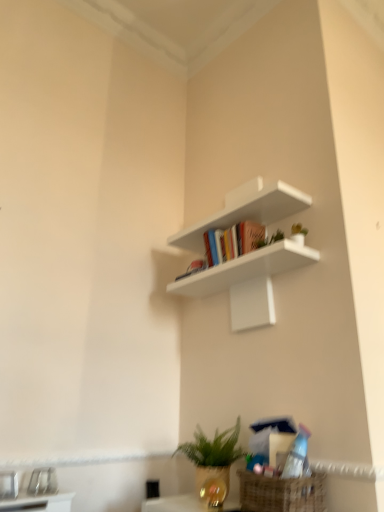
Question: Considering the positions of point (259, 430) and point (213, 280), is point (259, 430) closer or farther from the camera than point (213, 280)?

Choices:
 (A) closer
 (B) farther

Answer: (A)

Question: From a real-world perspective, is matte plastic book at center positioned above or below white matte shelf at upper center?

Choices:
 (A) below
 (B) above

Answer: (A)

Question: Which of these objects is positioned closest to the matte plastic book at center?

Choices:
 (A) white matte shelf at upper center
 (B) green matte plant at lower center

Answer: (B)

Question: Which is farther from the matte plastic book at center?

Choices:
 (A) white matte shelf at upper center
 (B) green matte plant at lower center

Answer: (A)